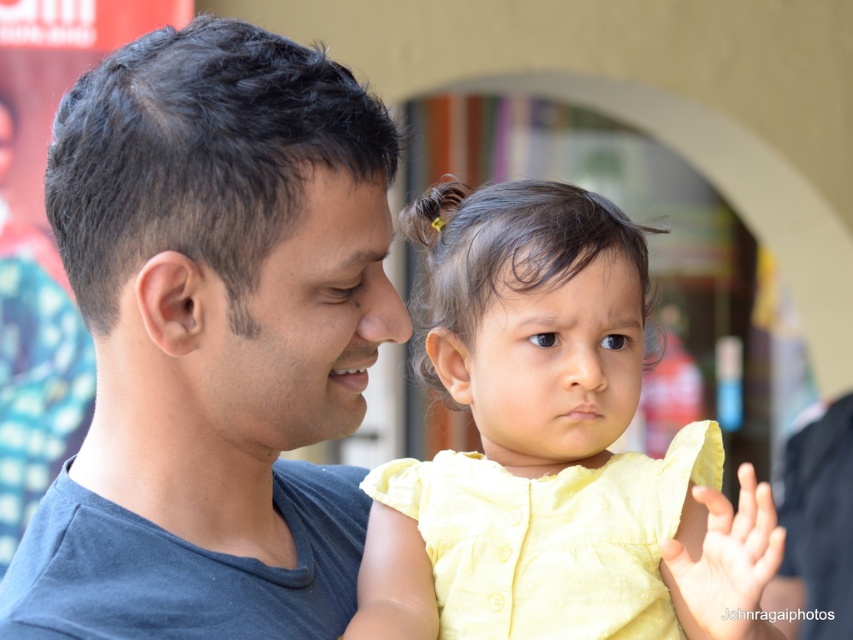
Question: Can you confirm if yellow cotton dress at center is bigger than dark brown hair at center?

Choices:
 (A) yes
 (B) no

Answer: (A)

Question: Which of the following is the closest to the observer?

Choices:
 (A) matte gray shirt at left
 (B) dark brown hair at center

Answer: (A)

Question: Does yellow cotton dress at center appear on the right side of dark brown hair at center?

Choices:
 (A) yes
 (B) no

Answer: (B)

Question: Does matte gray shirt at left have a larger size compared to yellow cotton dress at center?

Choices:
 (A) yes
 (B) no

Answer: (B)

Question: Which point is farther to the camera?

Choices:
 (A) matte gray shirt at left
 (B) dark brown hair at center
 (C) yellow cotton dress at center

Answer: (B)

Question: Which point is closer to the camera?

Choices:
 (A) yellow cotton dress at center
 (B) dark brown hair at center
 (C) matte gray shirt at left

Answer: (C)